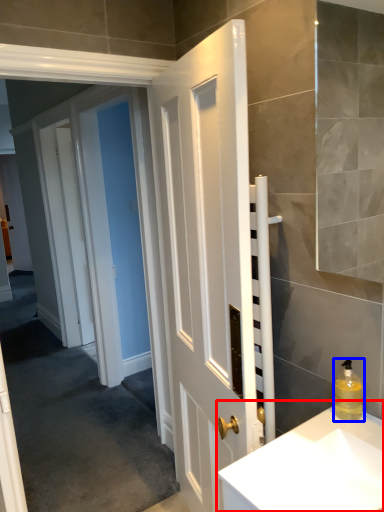
Question: Which point is closer to the camera, sink (highlighted by a red box) or soap dispenser (highlighted by a blue box)?

Choices:
 (A) sink
 (B) soap dispenser

Answer: (A)